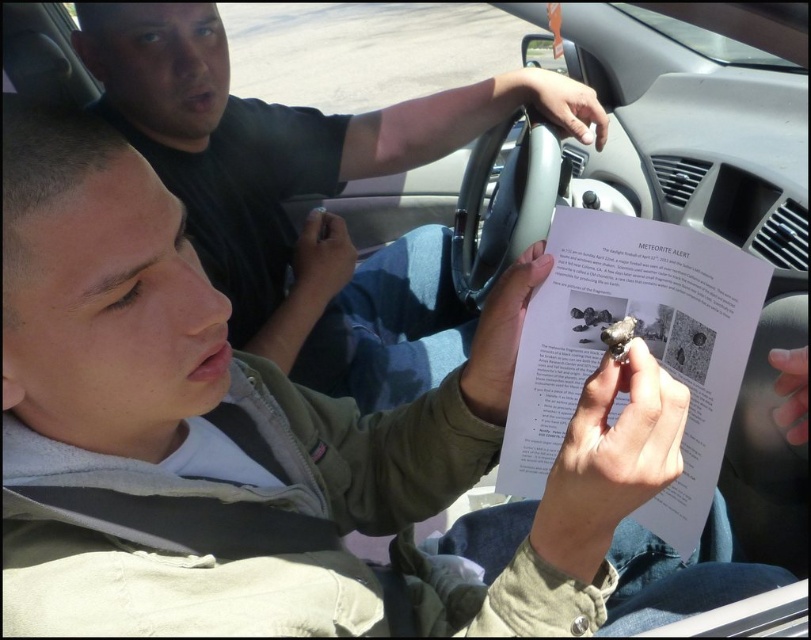
Can you confirm if matte black paper at center is taller than shiny metallic rock at center?

Indeed, matte black paper at center has a greater height compared to shiny metallic rock at center.

Between point (181, 19) and point (683, 241), which one is positioned behind?

The point (181, 19) is more distant.

Locate an element on the screen. Image resolution: width=811 pixels, height=640 pixels. matte black paper at center is located at coordinates (305, 193).